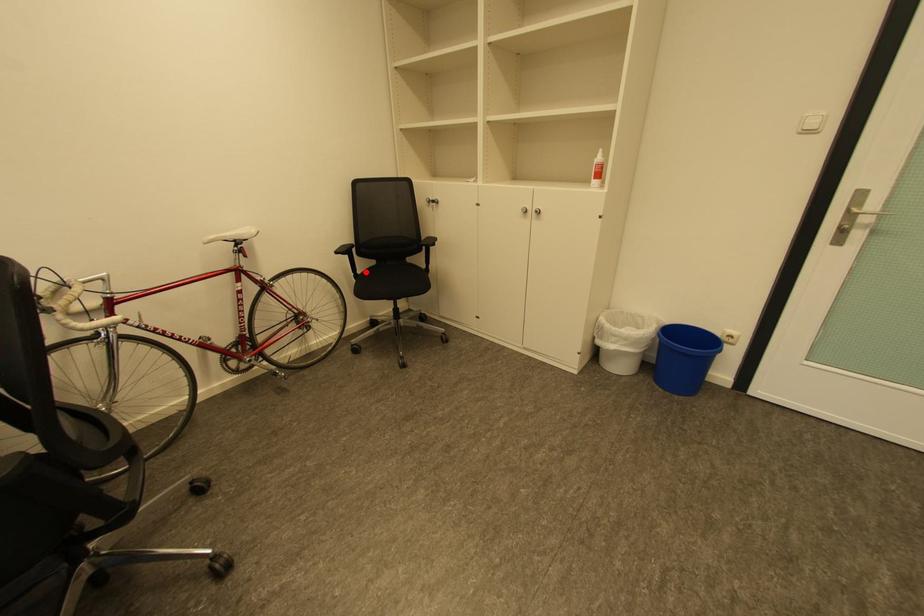
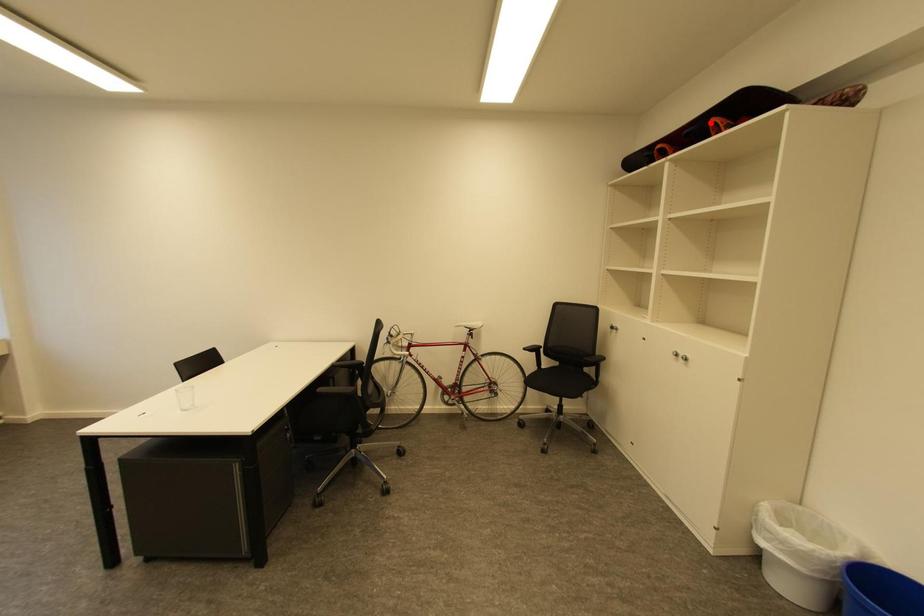
I am providing you with two images of the same scene from different viewpoints. A red point is marked on the first image and another point is marked on the second image. Is the red point in image1 aligned with the point shown in image2?

No